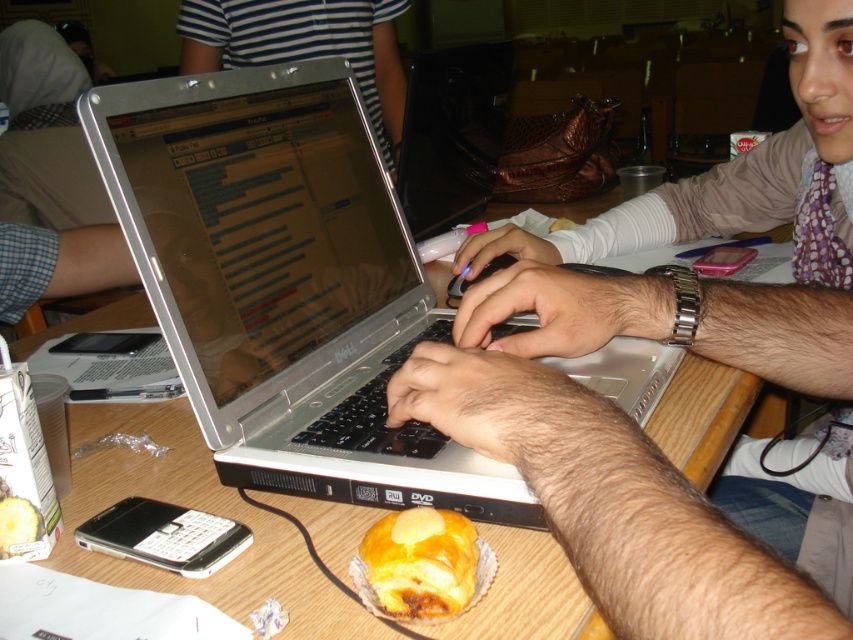
The width and height of the screenshot is (853, 640). What do you see at coordinates (693, 349) in the screenshot?
I see `metallic silver laptop at center` at bounding box center [693, 349].

Does metallic silver laptop at center lie behind golden flaky pastry at lower center?

No, it is not.

Between point (509, 436) and point (387, 589), which one is positioned in front?

Point (387, 589)

In order to click on metallic silver laptop at center in this screenshot , I will do `click(693, 349)`.

Is point (445, 177) farther from camera compared to point (399, 577)?

Yes, point (445, 177) is farther from viewer.

Does glossy plastic laptop at center have a smaller size compared to golden flaky pastry at lower center?

No.

Does point (421, 172) come behind point (477, 548)?

Yes.

In order to click on glossy plastic laptop at center in this screenshot , I will do `click(451, 132)`.

Between point (189, 19) and point (447, 202), which one is positioned behind?

The point (189, 19) is more distant.

Is point (231, 28) closer to camera compared to point (485, 86)?

No, it is not.

You are a GUI agent. You are given a task and a screenshot of the screen. Output one action in this format:
    pyautogui.click(x=<x>, y=<y>)
    Task: Click on the striped fabric shirt at upper center
    Image resolution: width=853 pixels, height=640 pixels.
    Given the screenshot: What is the action you would take?
    pyautogui.click(x=305, y=45)